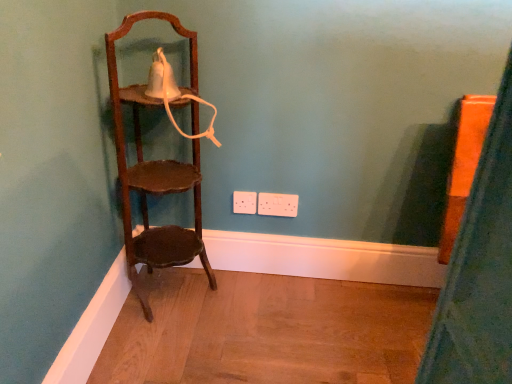
Find the location of a particular element. This screenshot has width=512, height=384. vacant area that is situated to the right of wooden shelf at left is located at coordinates (247, 304).